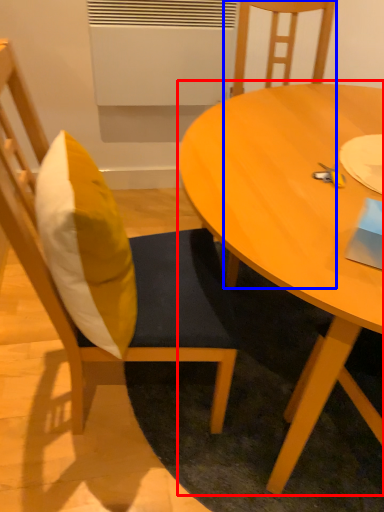
Question: Among these objects, which one is nearest to the camera, coffee table (highlighted by a red box) or chair (highlighted by a blue box)?

Choices:
 (A) coffee table
 (B) chair

Answer: (A)